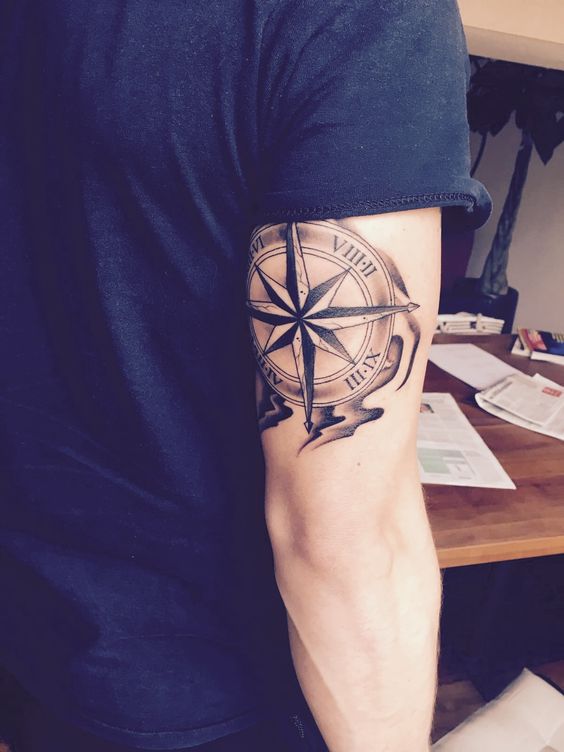
At what (x,y) coordinates should I click in order to perform the action: click on papers. Please return your answer as a coordinate pair (x, y). This screenshot has height=752, width=564. Looking at the image, I should click on (544, 402), (451, 443), (472, 371).